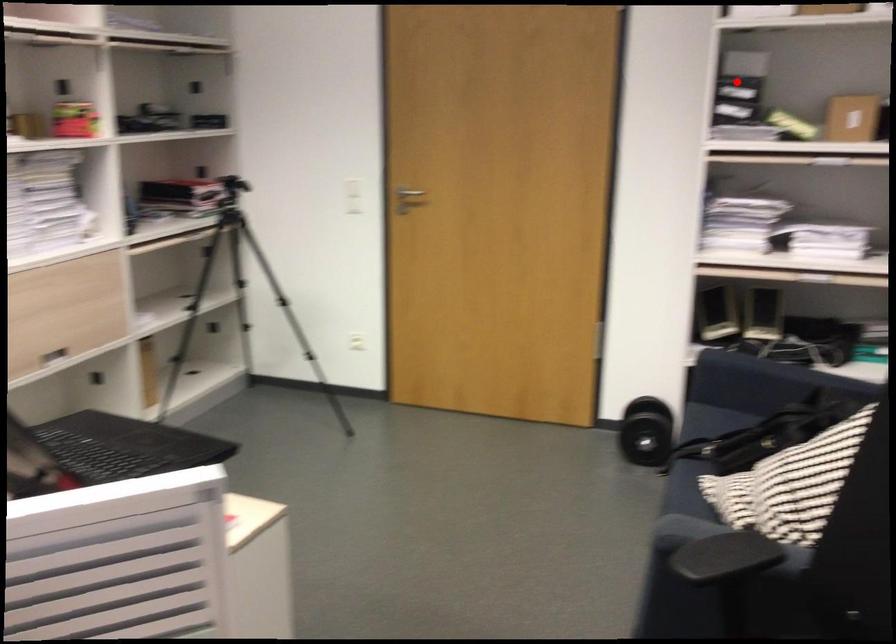
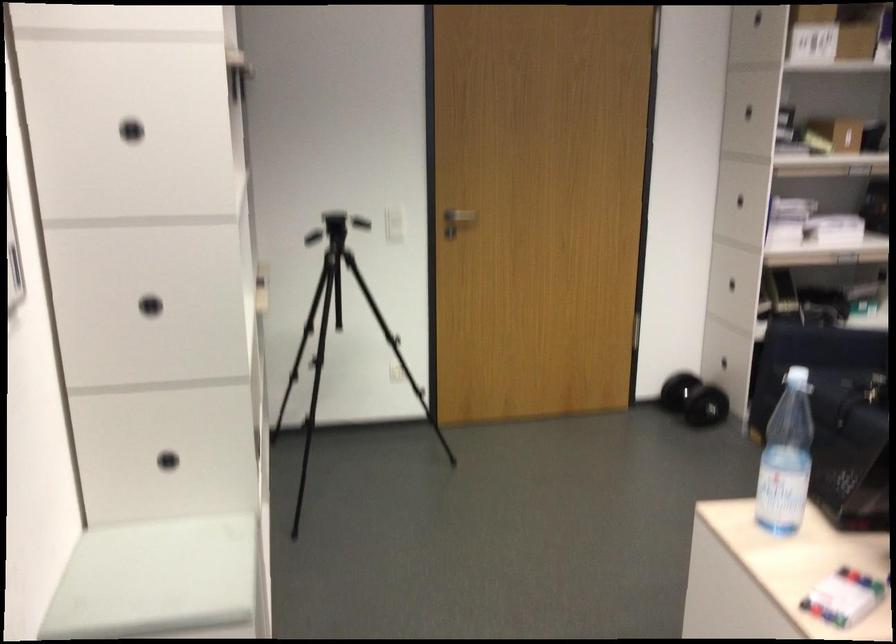
Question: A red point is marked in image1. In image2, is the corresponding 3D point closer to the camera or farther? Reply with the corresponding letter.

Choices:
 (A) The corresponding 3D point is closer.
 (B) The corresponding 3D point is farther.

Answer: (B)